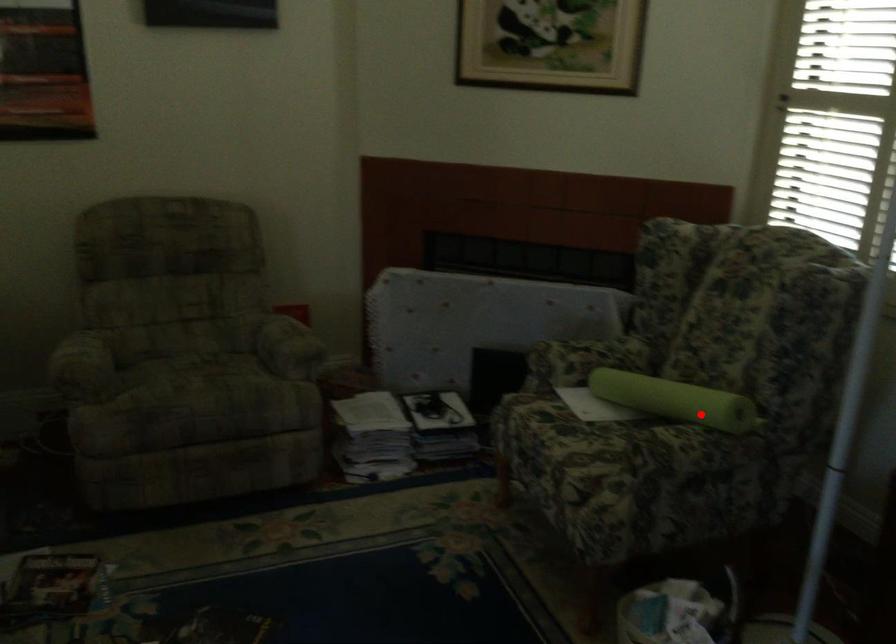
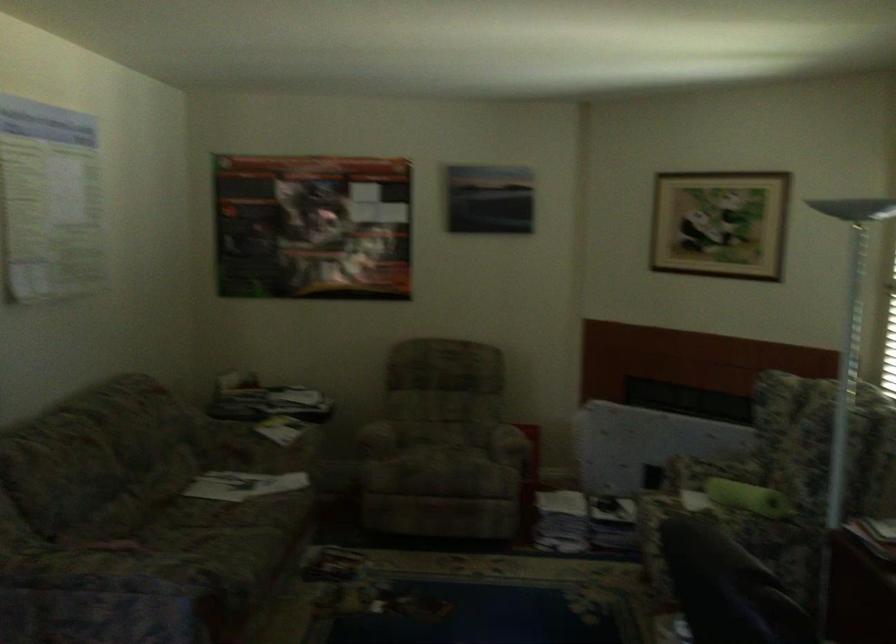
Question: I am providing you with two images of the same scene from different viewpoints. Image1 has a red point marked. In image2, the corresponding 3D location appears at what relative position? Reply with the corresponding letter.

Choices:
 (A) Closer
 (B) Farther

Answer: (B)